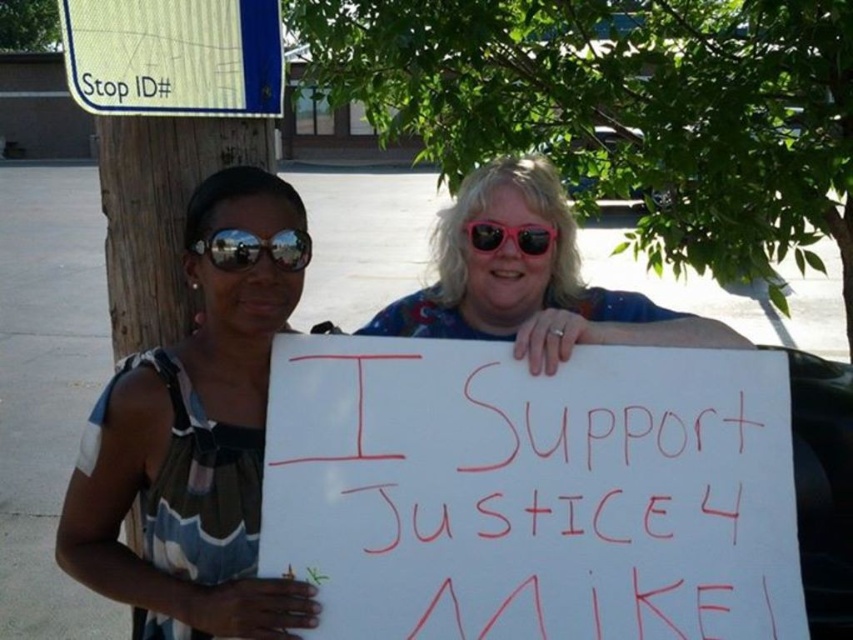
You are a photographer trying to capture a clear photo of the white paper sign at center and the matte black sunglasses at left. Which object should you zoom in on to ensure it fits entirely within the frame without cropping?

The white paper sign at center has a larger width than the matte black sunglasses at left, so you should zoom in on the matte black sunglasses at left to ensure it fits entirely within the frame without cropping.

What is the purpose of the point at coordinates (531, 492) in the image?

The point at coordinates (531, 492) marks the location of the white paper sign at center.